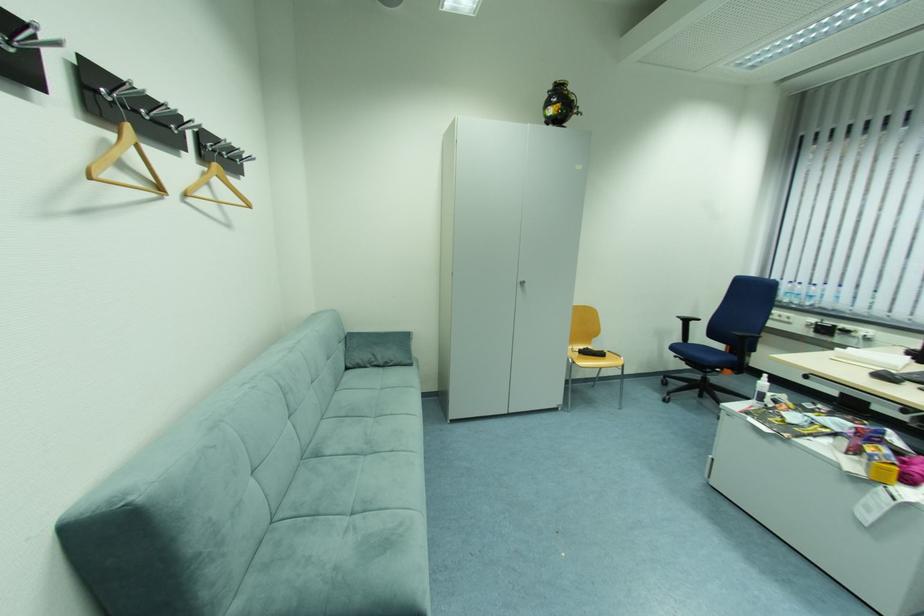
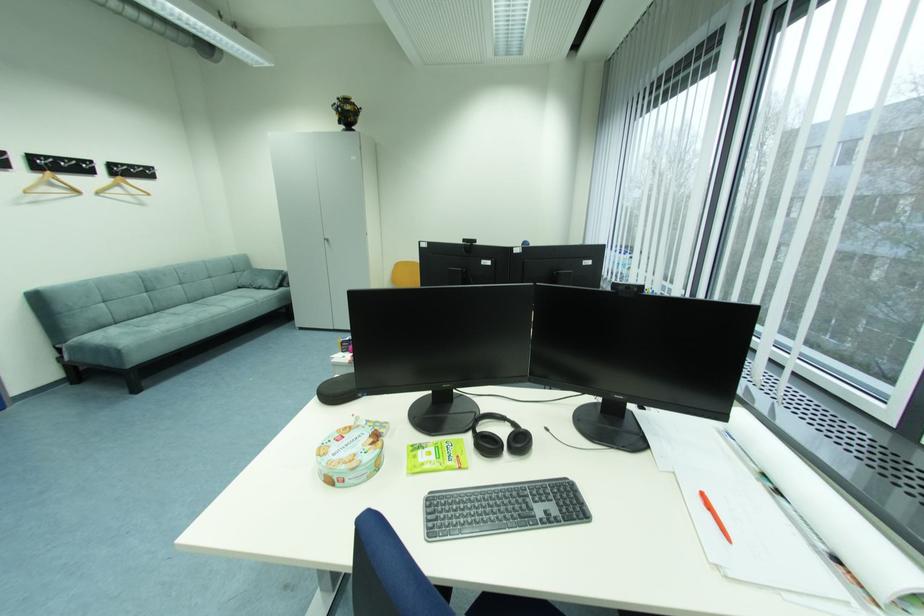
Find the pixel in the second image that matches point 354,370 in the first image.

(246, 288)